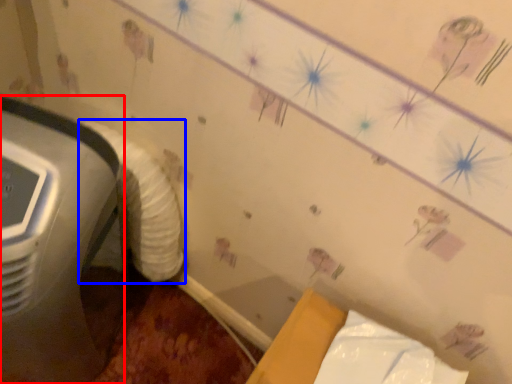
Question: Which point is closer to the camera, home appliance (highlighted by a red box) or sheet (highlighted by a blue box)?

Choices:
 (A) home appliance
 (B) sheet

Answer: (A)